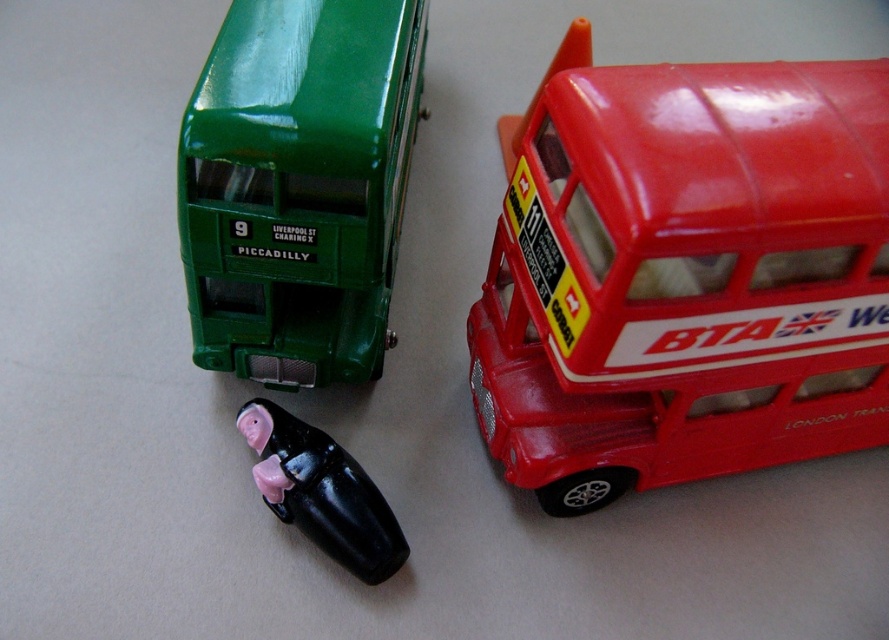
Question: Considering the relative positions of green glossy bus at upper left and black glossy piglet at center in the image provided, where is green glossy bus at upper left located with respect to black glossy piglet at center?

Choices:
 (A) left
 (B) right

Answer: (B)

Question: Which object is positioned farthest from the black glossy piglet at center?

Choices:
 (A) shiny plastic bus at upper right
 (B) green glossy bus at upper left

Answer: (A)

Question: Among these points, which one is farthest from the camera?

Choices:
 (A) (359, 500)
 (B) (271, 323)
 (C) (887, 173)

Answer: (B)

Question: Can you confirm if shiny plastic bus at upper right is thinner than green glossy bus at upper left?

Choices:
 (A) no
 (B) yes

Answer: (A)

Question: Is shiny plastic bus at upper right in front of black glossy piglet at center?

Choices:
 (A) yes
 (B) no

Answer: (A)

Question: Which is farther from the green glossy bus at upper left?

Choices:
 (A) black glossy piglet at center
 (B) shiny plastic bus at upper right

Answer: (B)